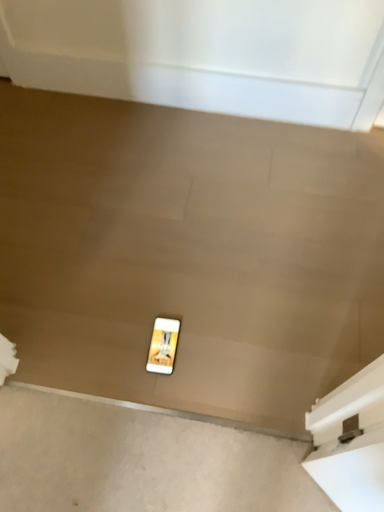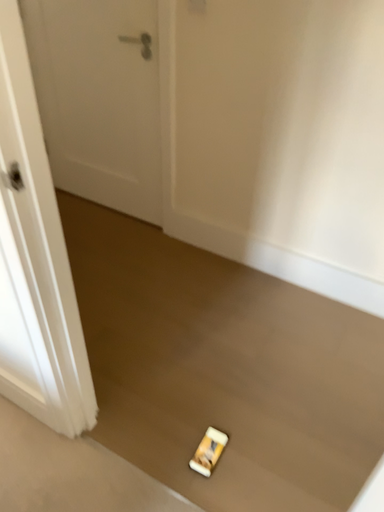
Question: Which way did the camera rotate in the video?

Choices:
 (A) rotated downward
 (B) rotated upward

Answer: (B)